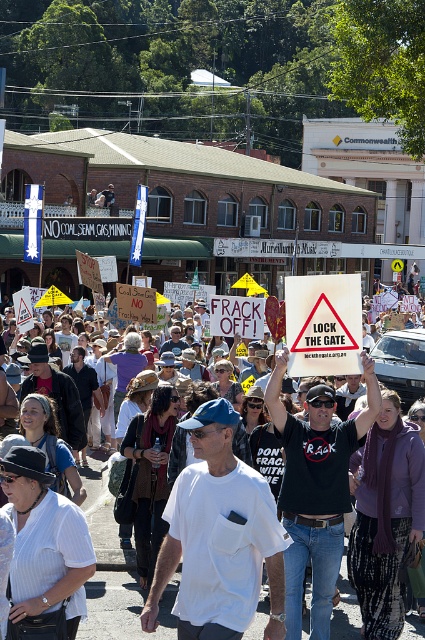
You are a photographer at the protest and want to capture both the white cotton shirt at center and the white paper placard at center in a single frame. Which object should you focus on to ensure both are visible without cropping?

The white cotton shirt at center occupies less space than the white paper placard at center, so focusing on the white paper placard at center would allow both objects to fit within the frame since it is larger and central.